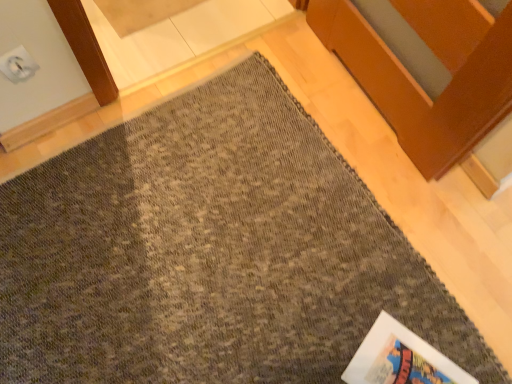
What do you see at coordinates (400, 358) in the screenshot? I see `white paper at lower right` at bounding box center [400, 358].

Locate an element on the screen. The height and width of the screenshot is (384, 512). white paper at lower right is located at coordinates (400, 358).

Image resolution: width=512 pixels, height=384 pixels. Identify the location of white paper at lower right. (400, 358).